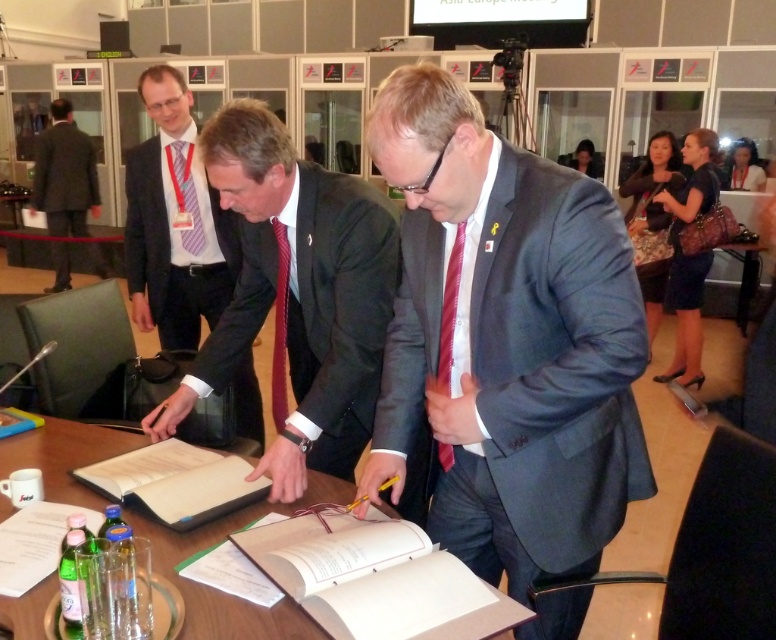
Is dark gray suit at upper left positioned at the back of red silk tie at center?

Yes, dark gray suit at upper left is further from the viewer.

Is dark gray suit at upper left smaller than red silk tie at center?

Incorrect, dark gray suit at upper left is not smaller in size than red silk tie at center.

I want to click on dark gray suit at upper left, so click(175, 221).

Where is `dark gray suit at upper left`? dark gray suit at upper left is located at coordinates (175, 221).

Can you confirm if dark gray suit at center is taller than red silk tie at center?

Indeed, dark gray suit at center has a greater height compared to red silk tie at center.

Does dark gray suit at center have a greater width compared to red silk tie at center?

Correct, the width of dark gray suit at center exceeds that of red silk tie at center.

Who is more distant from viewer, (553,532) or (449,364)?

The point (449,364) is more distant.

What are the coordinates of `dark gray suit at center` in the screenshot? It's located at (508, 340).

Measure the distance between point (244, 397) and camera.

Point (244, 397) is 3.18 meters from camera.

Is the position of dark gray suit at upper left more distant than that of dark gray suit at left?

That is False.

Does point (182, 195) come in front of point (47, 179)?

Yes.

Identify the location of dark gray suit at upper left. (175, 221).